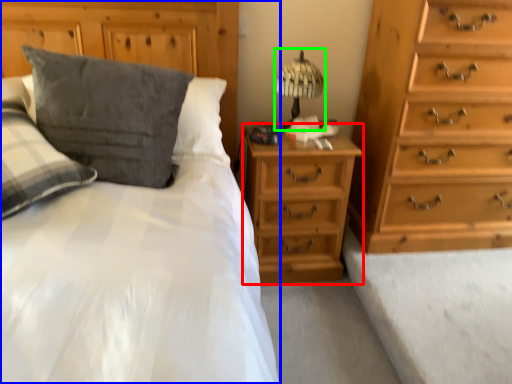
Question: Based on their relative distances, which object is nearer to nightstand (highlighted by a red box)? Choose from bed (highlighted by a blue box) and table lamp (highlighted by a green box).

Choices:
 (A) bed
 (B) table lamp

Answer: (B)